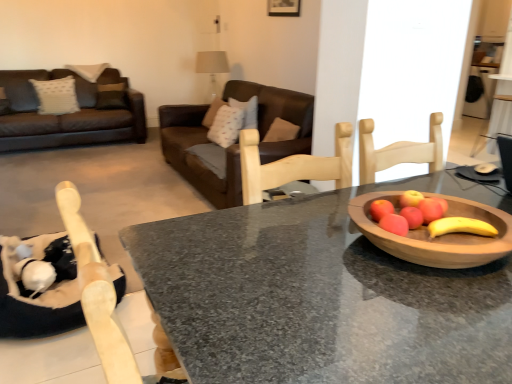
Where is `vacant space that is to the left of wooden bowl at right`? vacant space that is to the left of wooden bowl at right is located at coordinates (286, 256).